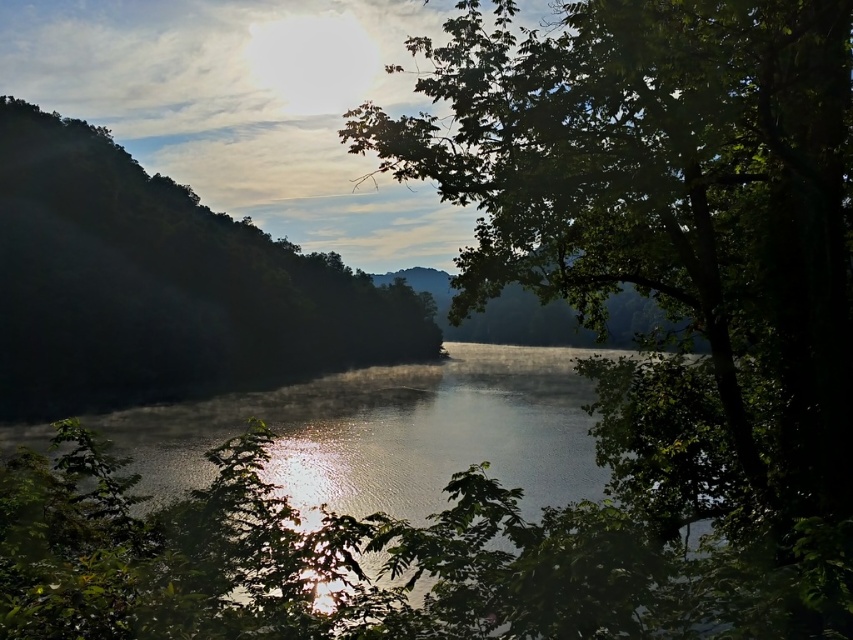
Question: Estimate the real-world distances between objects in this image. Which object is closer to the glistening water at center?

Choices:
 (A) green leafy tree at center
 (B) green leafy tree at left

Answer: (A)

Question: Which of the following is the farthest from the observer?

Choices:
 (A) (635, 141)
 (B) (303, 260)
 (C) (386, 468)

Answer: (B)

Question: Estimate the real-world distances between objects in this image. Which object is closer to the green leafy tree at center?

Choices:
 (A) green leafy tree at left
 (B) glistening water at center

Answer: (B)

Question: Does green leafy tree at center appear under green leafy tree at left?

Choices:
 (A) yes
 (B) no

Answer: (A)

Question: Does green leafy tree at center appear on the right side of green leafy tree at left?

Choices:
 (A) no
 (B) yes

Answer: (B)

Question: Is green leafy tree at center smaller than glistening water at center?

Choices:
 (A) no
 (B) yes

Answer: (B)